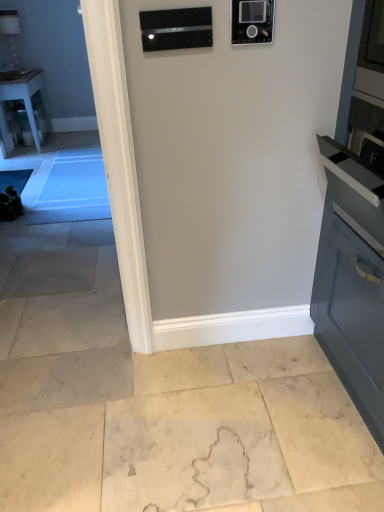
Question: Can you confirm if black glass microwave at upper center, which is counted as the first appliance, starting from the left, is bigger than clear glass table at left?

Choices:
 (A) yes
 (B) no

Answer: (B)

Question: Does black glass microwave at upper center, placed as the 2th appliance when sorted from right to left, have a lesser height compared to clear glass table at left?

Choices:
 (A) yes
 (B) no

Answer: (A)

Question: From a real-world perspective, is black glass microwave at upper center, which is counted as the first appliance, starting from the left, positioned under clear glass table at left based on gravity?

Choices:
 (A) no
 (B) yes

Answer: (A)

Question: From the image's perspective, does black glass microwave at upper center, which is counted as the first appliance, starting from the left, appear lower than clear glass table at left?

Choices:
 (A) no
 (B) yes

Answer: (B)

Question: Could clear glass table at left be considered to be inside black glass microwave at upper center, which is counted as the first appliance, starting from the left?

Choices:
 (A) no
 (B) yes

Answer: (A)

Question: Considering the positions of clear glass table at left and black glass microwave at upper center, placed as the 2th appliance when sorted from right to left, in the image, is clear glass table at left taller or shorter than black glass microwave at upper center, placed as the 2th appliance when sorted from right to left,?

Choices:
 (A) short
 (B) tall

Answer: (B)

Question: Choose the correct answer: Is clear glass table at left inside black glass microwave at upper center, placed as the 2th appliance when sorted from right to left, or outside it?

Choices:
 (A) inside
 (B) outside

Answer: (B)

Question: Considering the relative positions of clear glass table at left and black glass microwave at upper center, placed as the 2th appliance when sorted from right to left, in the image provided, is clear glass table at left to the left or to the right of black glass microwave at upper center, placed as the 2th appliance when sorted from right to left,?

Choices:
 (A) right
 (B) left

Answer: (B)

Question: From a real-world perspective, is clear glass table at left positioned above or below black glass microwave at upper center, placed as the 2th appliance when sorted from right to left?

Choices:
 (A) below
 (B) above

Answer: (A)

Question: Considering the relative positions of clear glass table at left and black glossy microwave at upper center, which is counted as the 2th appliance, starting from the left, in the image provided, is clear glass table at left to the left or to the right of black glossy microwave at upper center, which is counted as the 2th appliance, starting from the left,?

Choices:
 (A) right
 (B) left

Answer: (B)

Question: From the image's perspective, is clear glass table at left positioned above or below black glossy microwave at upper center, which ranks as the 1th appliance in right-to-left order?

Choices:
 (A) below
 (B) above

Answer: (B)

Question: Is clear glass table at left in front of or behind black glossy microwave at upper center, which is counted as the 2th appliance, starting from the left, in the image?

Choices:
 (A) behind
 (B) front

Answer: (A)

Question: Is clear glass table at left inside the boundaries of black glossy microwave at upper center, which is counted as the 2th appliance, starting from the left, or outside?

Choices:
 (A) inside
 (B) outside

Answer: (B)

Question: From a real-world perspective, is beige marble floor at lower center physically located above or below clear glass table at left?

Choices:
 (A) below
 (B) above

Answer: (A)

Question: From the image's perspective, is beige marble floor at lower center located above or below clear glass table at left?

Choices:
 (A) below
 (B) above

Answer: (A)